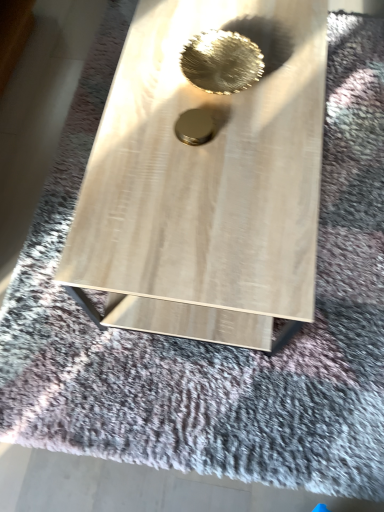
At what (x,y) coordinates should I click in order to perform the action: click on vacant region below metallic gold bowl at center, acting as the 2th hole starting from the bottom (from a real-world perspective). Please return your answer as a coordinate pair (x, y). The height and width of the screenshot is (512, 384). Looking at the image, I should click on (219, 72).